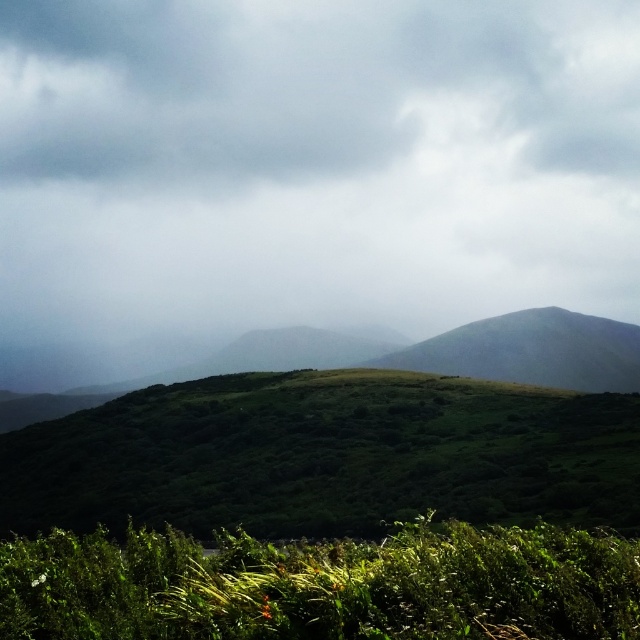
Question: Which object is the closest to the green leafy vegetation at center?

Choices:
 (A) green leafy grass at lower center
 (B) gray cloudy sky at upper center

Answer: (A)

Question: Considering the relative positions of green leafy vegetation at center and green leafy grass at lower center in the image provided, where is green leafy vegetation at center located with respect to green leafy grass at lower center?

Choices:
 (A) left
 (B) right

Answer: (B)

Question: Which point is farther to the camera?

Choices:
 (A) green leafy vegetation at center
 (B) gray cloudy sky at upper center
 (C) green leafy grass at lower center

Answer: (B)

Question: Is gray cloudy sky at upper center thinner than green leafy grass at lower center?

Choices:
 (A) no
 (B) yes

Answer: (A)

Question: Which object is farther from the camera taking this photo?

Choices:
 (A) green leafy vegetation at center
 (B) green leafy grass at lower center
 (C) gray cloudy sky at upper center

Answer: (C)

Question: Can you confirm if gray cloudy sky at upper center is positioned above green leafy vegetation at center?

Choices:
 (A) no
 (B) yes

Answer: (B)